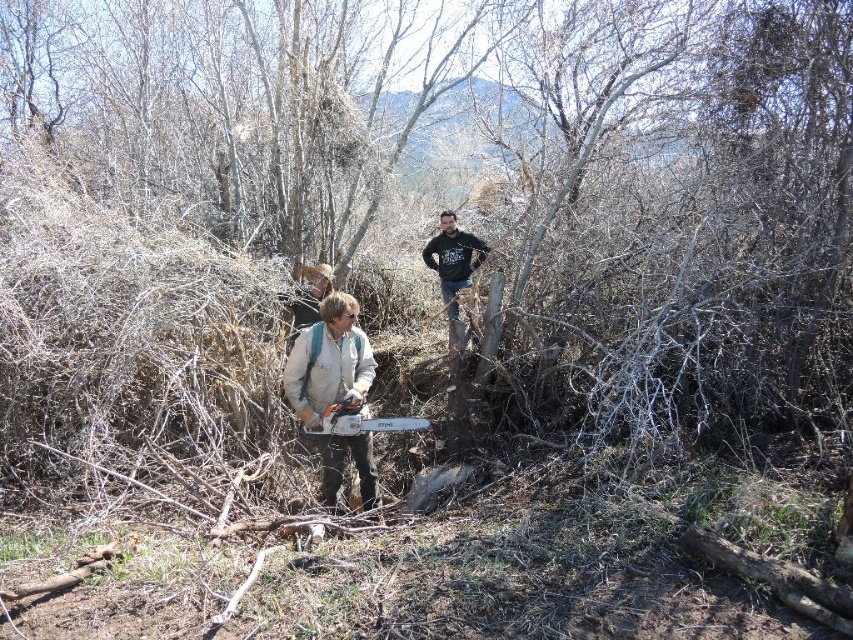
You are navigating through the wooded area and want to reach a specific location. You have two points marked on your map, point (305, 358) and point (444, 276). Which point is closer to your current position?

Point (305, 358) is closer to the viewer than point (444, 276), so it is the closer point.

You are a safety inspector assessing the scene. The safety guidelines state that the minimum safe distance between a chainsaw operator and other workers should be at least 12 feet to prevent injury from kickback or falling debris. Based on the provided information, is the distance between the black cotton sweatshirt at upper center and the metallic gray chainsaw at center compliant with the safety guidelines?

The distance between the black cotton sweatshirt at upper center and the metallic gray chainsaw at center is 10.68 feet, which is less than the required 12 feet. Therefore, the current distance does not comply with the safety guidelines.

You are a safety inspector checking the equipment arrangement in the wooded area. According to the scene, is the metallic gray chainsaw at center positioned in a way that could pose a safety hazard if the person wearing the black cotton sweatshirt at upper center turns around suddenly?

The metallic gray chainsaw at center is behind the black cotton sweatshirt at upper center, so if the person turns around suddenly, they might collide with the chainsaw, posing a safety hazard.